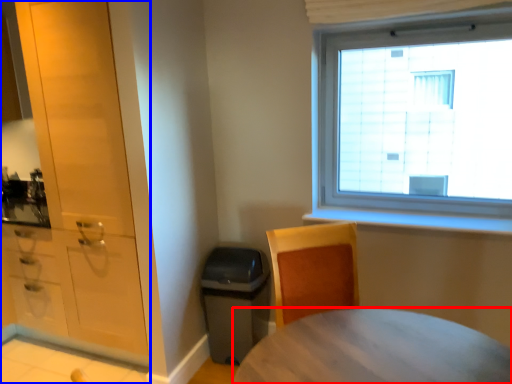
Question: Which object appears farthest to the camera in this image, desk (highlighted by a red box) or cabinetry (highlighted by a blue box)?

Choices:
 (A) desk
 (B) cabinetry

Answer: (B)